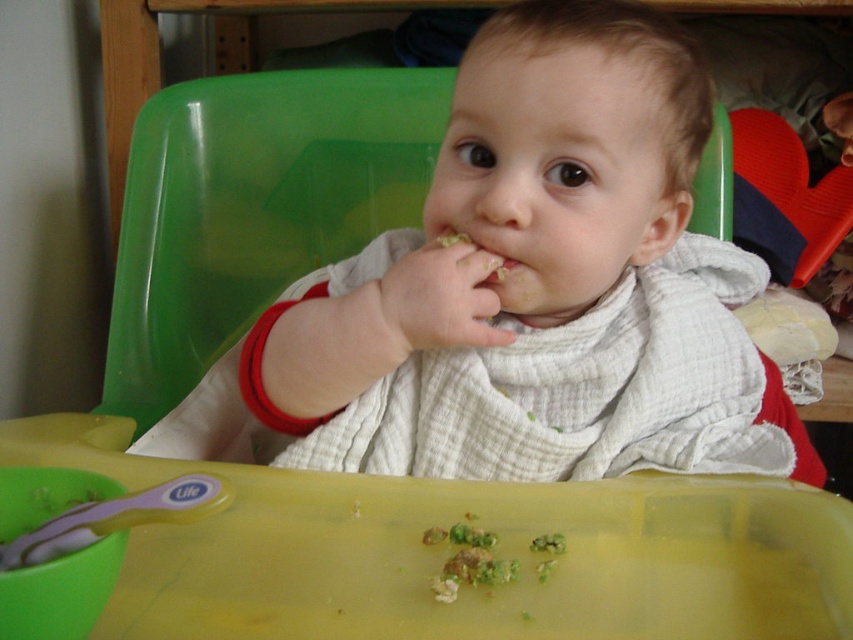
Looking at this image, can you confirm if white textured bib at center is wider than green textured food at tray center?

Correct, the width of white textured bib at center exceeds that of green textured food at tray center.

Between white textured bib at center and green textured food at tray center, which one is positioned lower?

green textured food at tray center is lower down.

Who is more distant from viewer, (727, 435) or (486, 540)?

Positioned behind is point (727, 435).

You are a GUI agent. You are given a task and a screenshot of the screen. Output one action in this format:
    pyautogui.click(x=<x>, y=<y>)
    Task: Click on the white textured bib at center
    
    Given the screenshot: What is the action you would take?
    pyautogui.click(x=524, y=291)

Who is higher up, green textured food at tray center or fuzzy white food at mouth center?

fuzzy white food at mouth center is higher up.

Is point (424, 538) closer to camera compared to point (492, 259)?

Yes, point (424, 538) is in front of point (492, 259).

I want to click on green textured food at tray center, so click(x=468, y=561).

How distant is white textured bib at center from fuzzy white food at mouth center?

The distance of white textured bib at center from fuzzy white food at mouth center is 14.70 centimeters.

Between white textured bib at center and fuzzy white food at mouth center, which one is positioned lower?

Positioned lower is white textured bib at center.

Describe the element at coordinates (524, 291) in the screenshot. I see `white textured bib at center` at that location.

This screenshot has height=640, width=853. I want to click on white textured bib at center, so click(x=524, y=291).